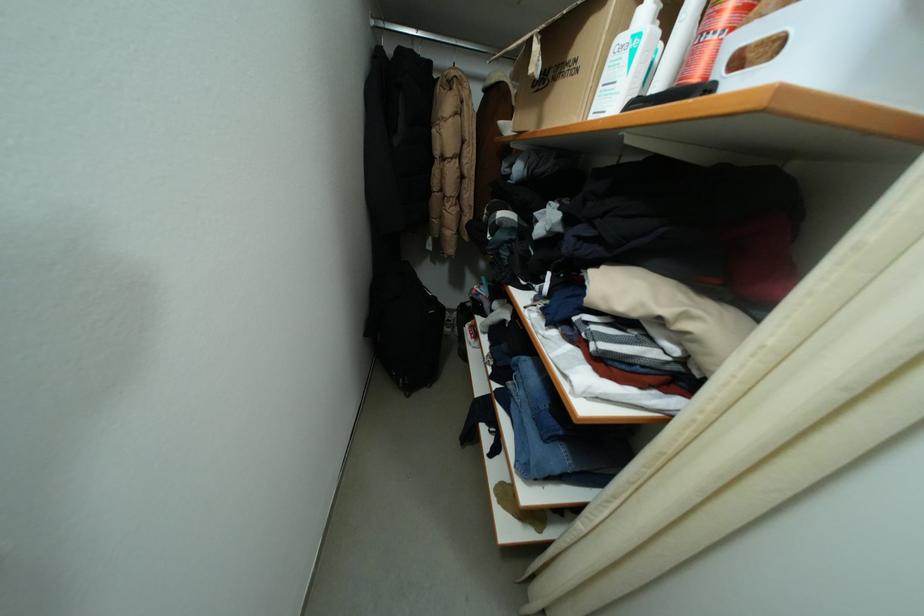
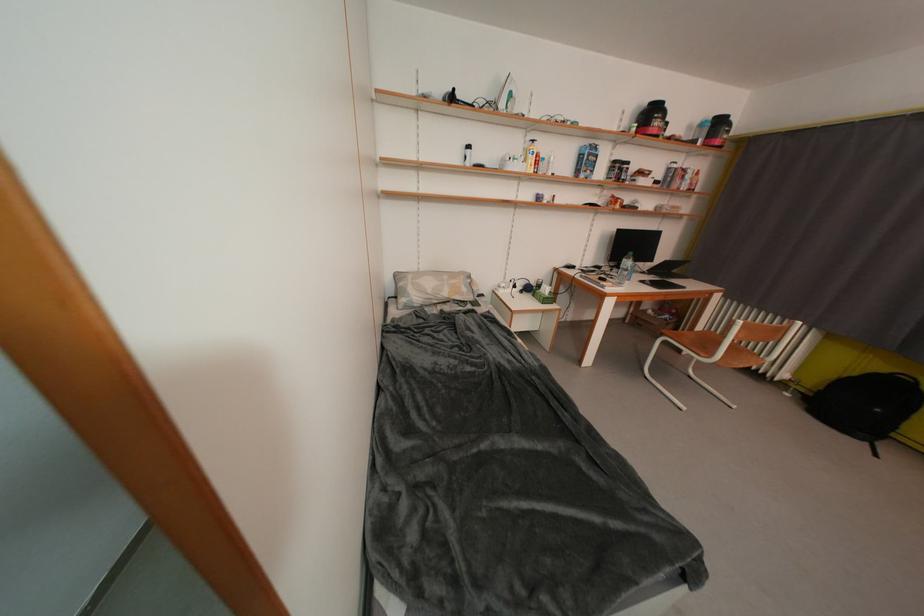
Question: The images are taken continuously from a first-person perspective. In which direction is your viewpoint rotating?

Choices:
 (A) Left
 (B) Right
 (C) Up
 (D) Down

Answer: (B)